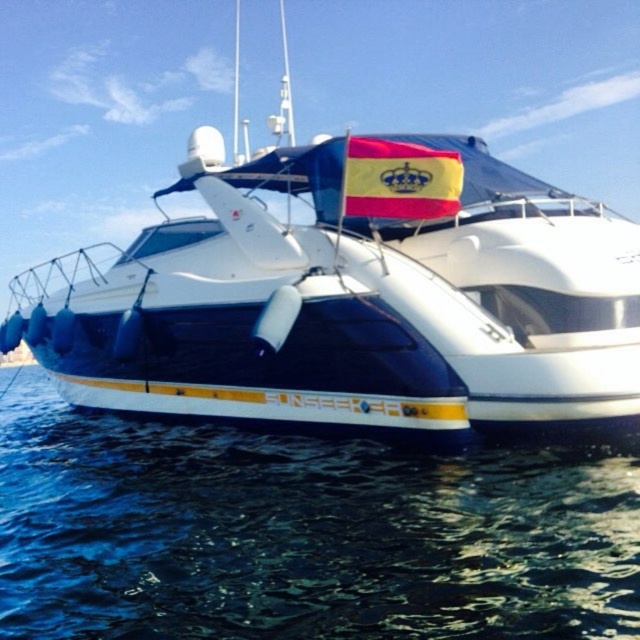
In the scene shown: You are a photographer trying to capture the white glossy boat at center and the blue water at lower left in a single shot. Considering their heights, which object will appear taller in the photograph?

The white glossy boat at center will appear taller in the photograph since it has a greater height compared to the blue water at lower left.

You are a photographer on a nearby boat. You want to take a photo of the white glossy boat at center and the blue water at lower left. Based on their positions, which object should appear lower in the photo?

The blue water at lower left should appear lower in the photo because the white glossy boat at center is located above it.